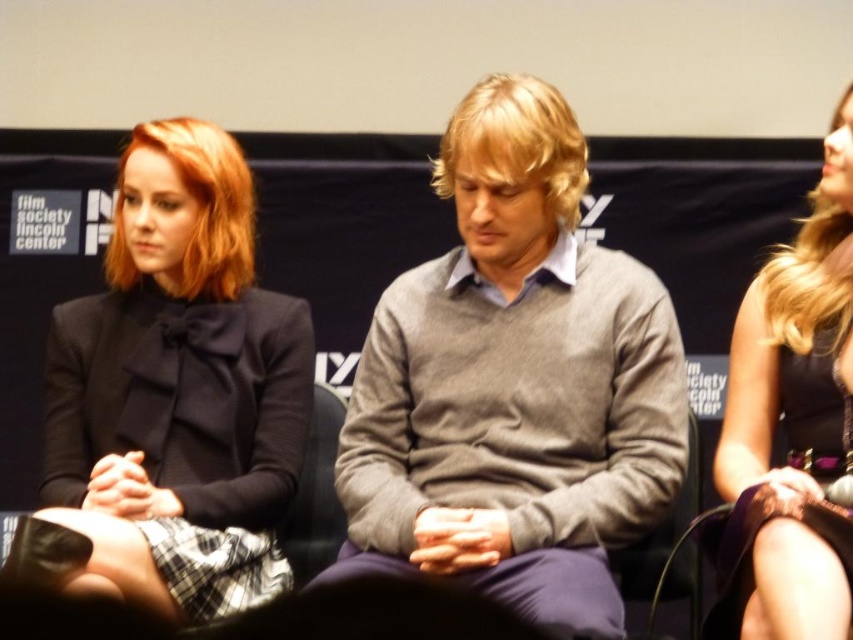
You are a photographer at the Film Society Lincoln Center event. You need to arrange the lighting so that the gray sweater at center and the matte black dress at left are both well lit. Based on their positions, which object should be placed closer to the left side of the lighting setup?

The matte black dress at left should be placed closer to the left side of the lighting setup because it is positioned to the left of the gray sweater at center.

You are a fashion designer observing the panel discussion. You notice two black dresses worn by the participants. Which dress is taller, the matte black dress at left or the satin black dress at center?

The matte black dress at left is taller than the satin black dress at center.

Where is the gray sweater at center located in the image?

The gray sweater at center is located at point coordinates of [514,385].